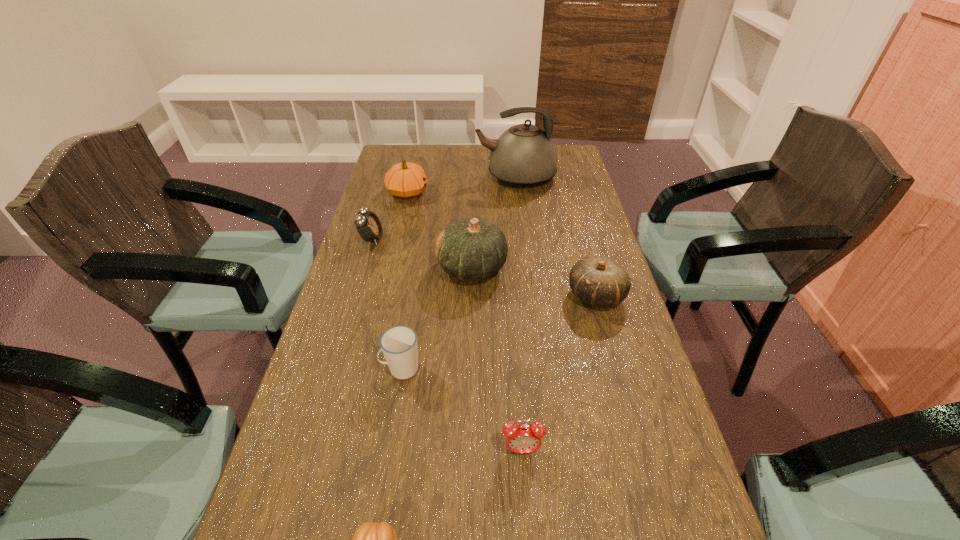
The image size is (960, 540). What are the coordinates of `kettle that is at the right edge` in the screenshot? It's located at (524, 156).

Identify the location of gourd located in the right edge section of the desktop. (597, 280).

Where is `object at the far right corner`? object at the far right corner is located at coordinates (524, 156).

Image resolution: width=960 pixels, height=540 pixels. Find the location of `vacant space at the far edge of the desktop`. vacant space at the far edge of the desktop is located at coordinates (469, 167).

This screenshot has height=540, width=960. Identify the location of free space at the left edge of the desktop. (338, 521).

You are a GUI agent. You are given a task and a screenshot of the screen. Output one action in this format:
    pyautogui.click(x=<x>, y=<y>)
    Task: Click on the free space at the right edge of the desktop
    This screenshot has height=540, width=960.
    Given the screenshot: What is the action you would take?
    pyautogui.click(x=627, y=474)

Where is `unoccupied area between the rightmost gourd and the tallest gourd`? The width and height of the screenshot is (960, 540). unoccupied area between the rightmost gourd and the tallest gourd is located at coordinates (534, 282).

Where is `vacant area between the tallest gourd and the third nearest object`? vacant area between the tallest gourd and the third nearest object is located at coordinates (436, 318).

The height and width of the screenshot is (540, 960). Find the location of `free space between the sixth farthest object and the seventh farthest object`. free space between the sixth farthest object and the seventh farthest object is located at coordinates (462, 409).

You are a GUI agent. You are given a task and a screenshot of the screen. Output one action in this format:
    pyautogui.click(x=<x>, y=<y>)
    Task: Click on the vacant area that lies between the kettle and the rightmost gourd
    This screenshot has width=960, height=540.
    Given the screenshot: What is the action you would take?
    pyautogui.click(x=556, y=237)